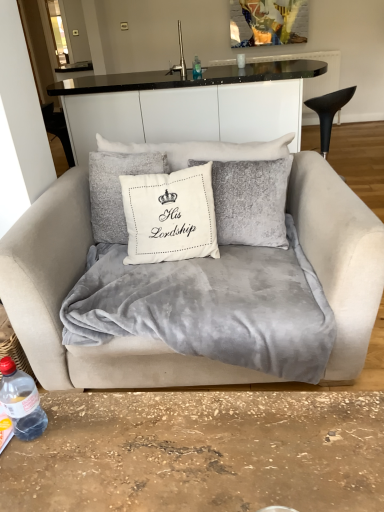
Question: From the image's perspective, is velvet gray blanket at center positioned above or below velvet beige couch at center?

Choices:
 (A) below
 (B) above

Answer: (A)

Question: Considering their positions, is velvet gray blanket at center located in front of or behind velvet beige couch at center?

Choices:
 (A) behind
 (B) front

Answer: (A)

Question: Estimate the real-world distances between objects in this image. Which object is farther from the velvet beige couch at center?

Choices:
 (A) white ceramic cup at upper center
 (B) transparent plastic bottle at center, positioned as the 2th bottle in bottom-to-top order
 (C) velvet gray blanket at center
 (D) transparent plastic bottle at lower left, which is the 2th bottle from top to bottom
 (E) silver metallic faucet at upper center

Answer: (A)

Question: Which is farther from the transparent plastic bottle at lower left, the 2th bottle from the right?

Choices:
 (A) white ceramic cup at upper center
 (B) transparent plastic bottle at center, positioned as the 2th bottle in bottom-to-top order
 (C) velvet gray blanket at center
 (D) silver metallic faucet at upper center
 (E) velvet beige couch at center

Answer: (A)